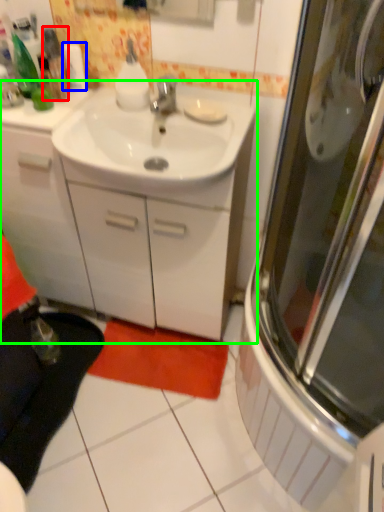
Question: Based on their relative distances, which object is nearer to bottle (highlighted by a red box)? Choose from toilet paper (highlighted by a blue box) and bathroom cabinet (highlighted by a green box).

Choices:
 (A) toilet paper
 (B) bathroom cabinet

Answer: (A)